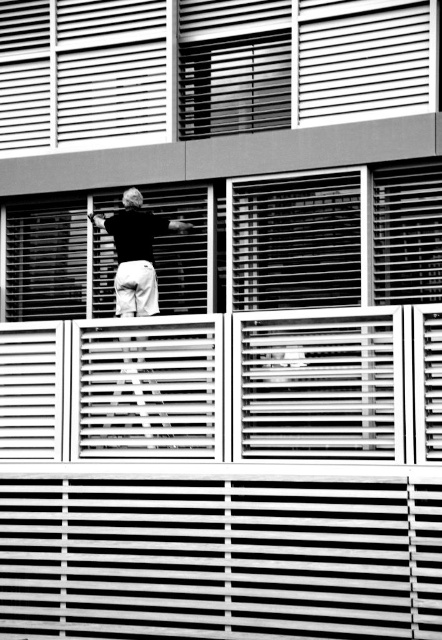
Question: Considering the relative positions of white slatted balcony at center and black matte skateboard at center in the image provided, where is white slatted balcony at center located with respect to black matte skateboard at center?

Choices:
 (A) below
 (B) above

Answer: (A)

Question: Which object appears closest to the camera in this image?

Choices:
 (A) black matte skateboard at center
 (B) white plastic blinds at upper center
 (C) white slatted balcony at center

Answer: (C)

Question: Which object is the closest to the white slatted balcony at center?

Choices:
 (A) black matte skateboard at center
 (B) white plastic blinds at upper center

Answer: (A)

Question: Which object appears farthest from the camera in this image?

Choices:
 (A) white slatted balcony at center
 (B) white plastic blinds at upper center
 (C) black matte skateboard at center

Answer: (C)

Question: Is white slatted balcony at center bigger than black matte skateboard at center?

Choices:
 (A) yes
 (B) no

Answer: (A)

Question: Does white plastic blinds at upper center come in front of black matte skateboard at center?

Choices:
 (A) yes
 (B) no

Answer: (A)